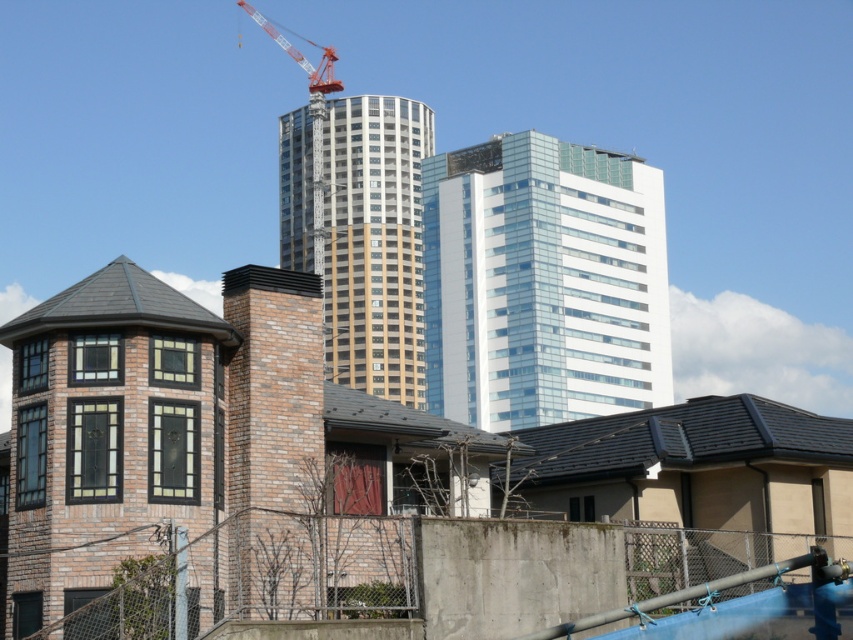
Question: Which object is the closest to the transparent glass building at center?

Choices:
 (A) beige glass tower at center
 (B) red metallic crane at upper center

Answer: (A)

Question: Can you confirm if transparent glass building at center is positioned below red metallic crane at upper center?

Choices:
 (A) no
 (B) yes

Answer: (B)

Question: Among these points, which one is nearest to the camera?

Choices:
 (A) click(x=340, y=84)
 (B) click(x=347, y=224)
 (C) click(x=564, y=221)

Answer: (C)

Question: Which point is farther from the camera taking this photo?

Choices:
 (A) (412, 280)
 (B) (311, 44)
 (C) (486, 236)

Answer: (B)

Question: Is transparent glass building at center closer to camera compared to red metallic crane at upper center?

Choices:
 (A) no
 (B) yes

Answer: (B)

Question: Can you confirm if transparent glass building at center is smaller than red metallic crane at upper center?

Choices:
 (A) yes
 (B) no

Answer: (A)